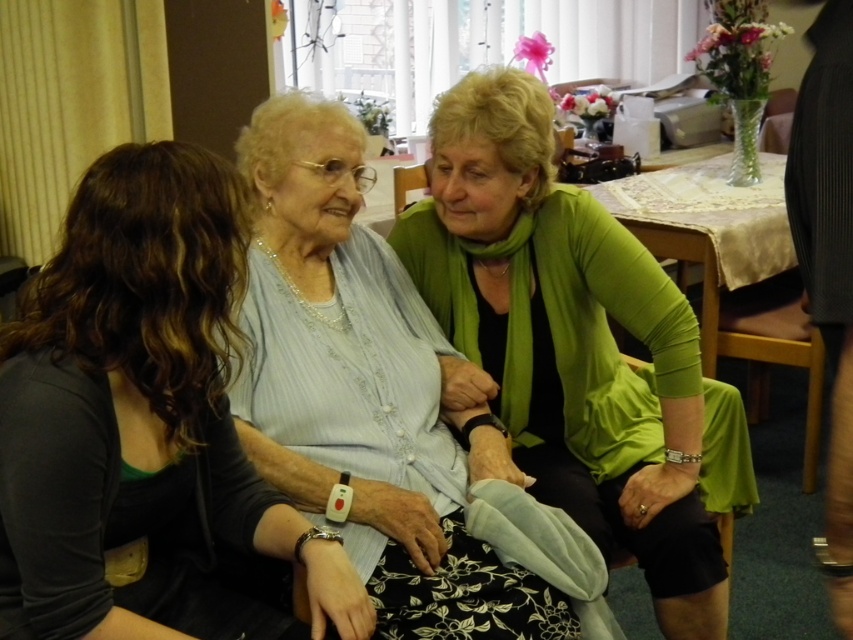
You are a delivery person who needs to place a small package between the green matte cardigan at center and the wooden chair at center. The package is 3 feet long. Will it fit in the space between them?

The distance between the green matte cardigan at center and the wooden chair at center is 3.65 feet. Since the package is 3 feet long, it will fit in the space between them as the available space is longer than the package.

You are a guest at this gathering and want to sit between the two people wearing the matte gray sweater at center and the light blue fabric at center. Is there enough space for you to sit between them?

The matte gray sweater at center is to the left of the light blue fabric at center, so there is space between them for you to sit.